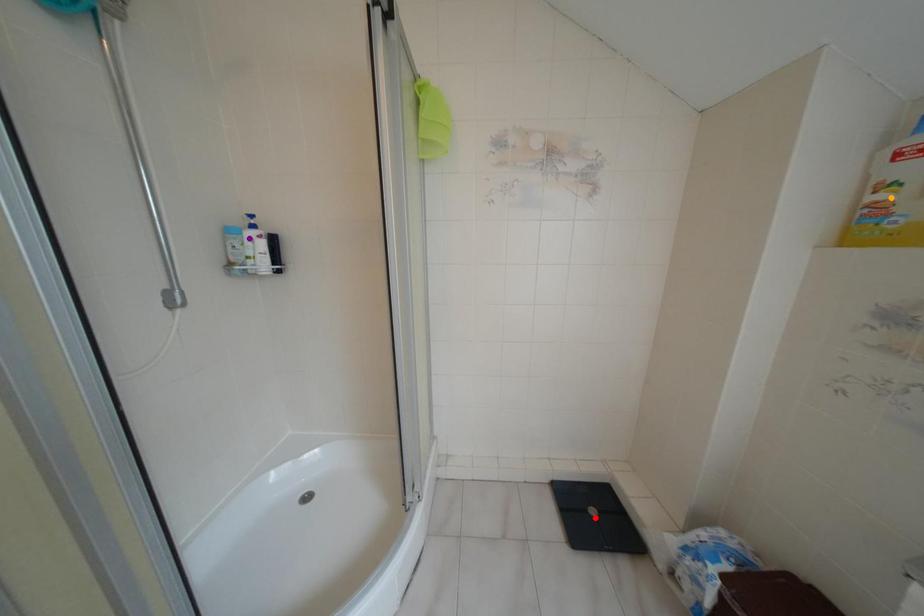
Order these from farthest to nearest:
- orange point
- red point
- purple point

red point, purple point, orange point